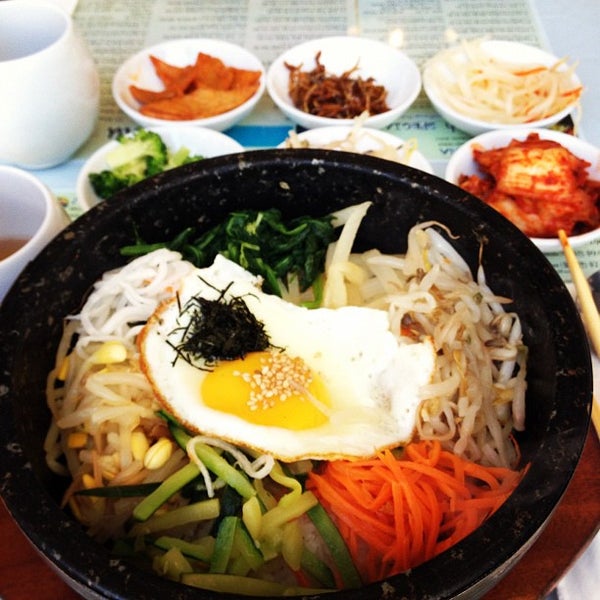
At what (x,y) coordinates should I click in order to perform the action: click on small bowl. Please return your answer as a coordinate pair (x, y). The width and height of the screenshot is (600, 600). Looking at the image, I should click on (468, 171), (444, 104), (401, 89), (361, 132), (233, 51), (198, 134).